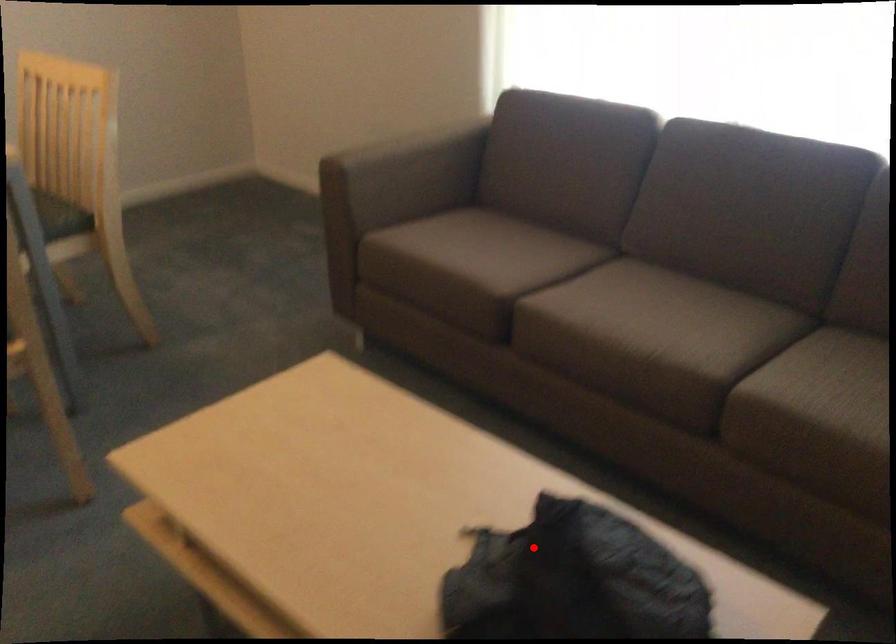
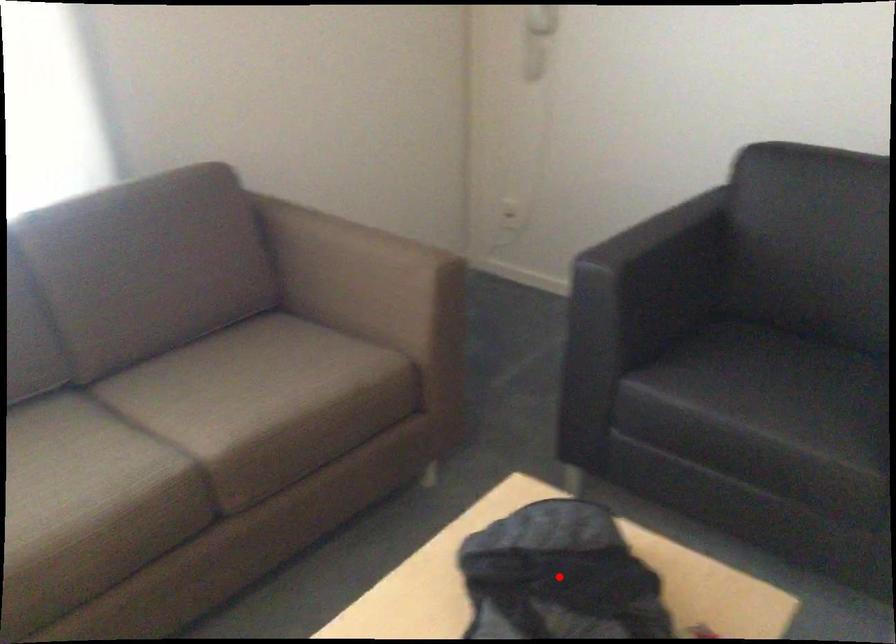
I am providing you with two images of the same scene from different viewpoints. A red point is marked on the first image and another point is marked on the second image. Is the red point in image1 aligned with the point shown in image2?

Yes